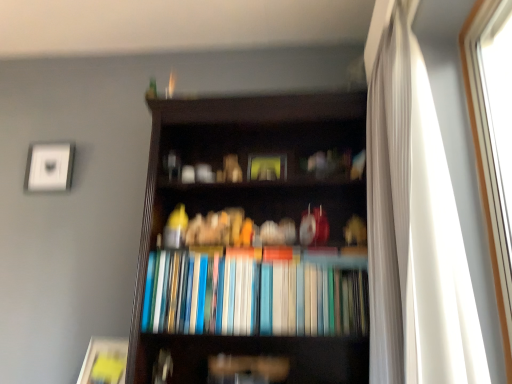
In order to click on matte yellow paperback book at lower left in this screenshot , I will do `click(104, 362)`.

Find the location of a particular element. Image resolution: width=512 pixels, height=384 pixels. dark wood bookcase at center is located at coordinates (248, 212).

Measure the distance between white glass window at right and camera.

The distance of white glass window at right from camera is 1.12 meters.

The height and width of the screenshot is (384, 512). Describe the element at coordinates (492, 143) in the screenshot. I see `white glass window at right` at that location.

What do you see at coordinates (251, 297) in the screenshot? Image resolution: width=512 pixels, height=384 pixels. I see `hardcover books at center` at bounding box center [251, 297].

What do you see at coordinates (413, 224) in the screenshot? I see `white sheer curtain at right` at bounding box center [413, 224].

Image resolution: width=512 pixels, height=384 pixels. I want to click on matte yellow paperback book at lower left, so click(104, 362).

Based on the photo, which object is wider, matte yellow paperback book at lower left or matte white picture frame at upper left?

With larger width is matte yellow paperback book at lower left.

From the image's perspective, is matte yellow paperback book at lower left on matte white picture frame at upper left?

Actually, matte yellow paperback book at lower left appears below matte white picture frame at upper left in the image.

Is matte yellow paperback book at lower left aimed at matte white picture frame at upper left?

No, matte yellow paperback book at lower left does not turn towards matte white picture frame at upper left.

From the image's perspective, relative to matte yellow paperback book at lower left, is dark wood bookcase at center above or below?

dark wood bookcase at center is above matte yellow paperback book at lower left.

Is point (210, 186) more distant than point (114, 373)?

Yes, point (210, 186) is behind point (114, 373).

From a real-world perspective, who is located lower, dark wood bookcase at center or matte yellow paperback book at lower left?

matte yellow paperback book at lower left.

Considering the relative sizes of white sheer curtain at right and matte yellow paperback book at lower left in the image provided, is white sheer curtain at right wider than matte yellow paperback book at lower left?

Yes, white sheer curtain at right is wider than matte yellow paperback book at lower left.

Would you say white sheer curtain at right is to the left or to the right of matte yellow paperback book at lower left in the picture?

white sheer curtain at right is positioned on matte yellow paperback book at lower left's right side.

Is white sheer curtain at right taller than matte yellow paperback book at lower left?

Yes, white sheer curtain at right is taller than matte yellow paperback book at lower left.

Would you say matte yellow paperback book at lower left is outside white glass window at right?

Indeed, matte yellow paperback book at lower left is completely outside white glass window at right.

From the picture: Who is smaller, matte yellow paperback book at lower left or white glass window at right?

With smaller size is matte yellow paperback book at lower left.

In terms of height, does matte yellow paperback book at lower left look taller or shorter compared to white glass window at right?

Considering their sizes, matte yellow paperback book at lower left has less height than white glass window at right.

Is matte yellow paperback book at lower left at the right side of white glass window at right?

No.

From the picture: Based on their positions, is matte yellow paperback book at lower left located to the left or right of dark wood bookcase at center?

Clearly, matte yellow paperback book at lower left is on the left of dark wood bookcase at center in the image.

This screenshot has height=384, width=512. Find the location of `paperback book below the dark wood bookcase at center (from the image's perspective)`. paperback book below the dark wood bookcase at center (from the image's perspective) is located at coordinates (104, 362).

In terms of height, does matte yellow paperback book at lower left look taller or shorter compared to dark wood bookcase at center?

Considering their sizes, matte yellow paperback book at lower left has less height than dark wood bookcase at center.

Between point (95, 383) and point (153, 350), which one is positioned behind?

The point (95, 383) is more distant.

Looking at this image, in terms of width, does white glass window at right look wider or thinner when compared to matte yellow paperback book at lower left?

white glass window at right is thinner than matte yellow paperback book at lower left.

Between white glass window at right and matte yellow paperback book at lower left, which one is positioned in front?

Positioned in front is white glass window at right.

Based on the photo, does white glass window at right turn towards matte yellow paperback book at lower left?

No, white glass window at right is not turned towards matte yellow paperback book at lower left.

Can you tell me how much white glass window at right and matte yellow paperback book at lower left differ in facing direction?

There is a 81.8-degree angle between the facing directions of white glass window at right and matte yellow paperback book at lower left.

From the image's perspective, which is above, white glass window at right or hardcover books at center?

white glass window at right, from the image's perspective.

Does white glass window at right have a greater height compared to hardcover books at center?

Indeed, white glass window at right has a greater height compared to hardcover books at center.

Can you confirm if white glass window at right is thinner than hardcover books at center?

Indeed, white glass window at right has a lesser width compared to hardcover books at center.

From a real-world perspective, which object stands above the other?

white glass window at right.

Where is `paperback book lying in front of the matte white picture frame at upper left`? This screenshot has height=384, width=512. paperback book lying in front of the matte white picture frame at upper left is located at coordinates (104, 362).

You are a GUI agent. You are given a task and a screenshot of the screen. Output one action in this format:
    pyautogui.click(x=<x>, y=<y>)
    Task: Click on the paperback book beneath the dark wood bookcase at center (from a real-world perspective)
    
    Given the screenshot: What is the action you would take?
    pyautogui.click(x=104, y=362)

Looking at the image, which one is located closer to white glass window at right, matte yellow paperback book at lower left or hardcover books at center?

The object closer to white glass window at right is hardcover books at center.

Which object lies further to the anchor point white sheer curtain at right, matte yellow paperback book at lower left or dark wood bookcase at center?

The object further to white sheer curtain at right is matte yellow paperback book at lower left.

Looking at the image, which one is located further to hardcover books at center, white glass window at right or matte yellow paperback book at lower left?

white glass window at right is positioned further to the anchor hardcover books at center.

Estimate the real-world distances between objects in this image. Which object is further from matte yellow paperback book at lower left, matte white picture frame at upper left or white sheer curtain at right?

Among the two, white sheer curtain at right is located further to matte yellow paperback book at lower left.

Considering their positions, is matte white picture frame at upper left positioned further to dark wood bookcase at center than hardcover books at center?

matte white picture frame at upper left lies further to dark wood bookcase at center than the other object.

From the image, which object appears to be nearer to white sheer curtain at right, white glass window at right or matte white picture frame at upper left?

white glass window at right is positioned closer to the anchor white sheer curtain at right.

In the scene shown: Estimate the real-world distances between objects in this image. Which object is further from dark wood bookcase at center, hardcover books at center or white glass window at right?

white glass window at right is positioned further to the anchor dark wood bookcase at center.

Based on the photo, from the image, which object appears to be farther from hardcover books at center, white sheer curtain at right or dark wood bookcase at center?

white sheer curtain at right is positioned further to the anchor hardcover books at center.

Where is `bookcase between matte white picture frame at upper left and white glass window at right in the horizontal direction`? The width and height of the screenshot is (512, 384). bookcase between matte white picture frame at upper left and white glass window at right in the horizontal direction is located at coordinates (248, 212).

I want to click on book between matte yellow paperback book at lower left and dark wood bookcase at center, so click(251, 297).

Locate an element on the screen. This screenshot has width=512, height=384. book between matte yellow paperback book at lower left and white glass window at right in the horizontal direction is located at coordinates (251, 297).

Image resolution: width=512 pixels, height=384 pixels. Find the location of `curtain between dark wood bookcase at center and white glass window at right`. curtain between dark wood bookcase at center and white glass window at right is located at coordinates (413, 224).